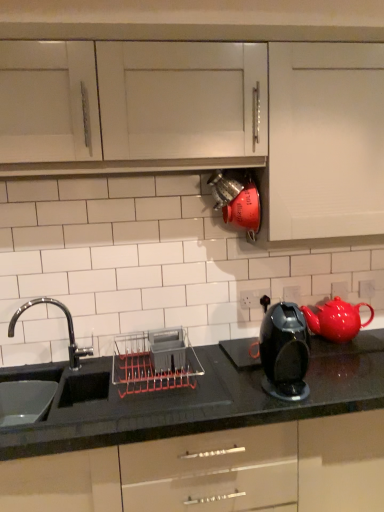
Question: Would you say red glossy teapot at right is inside or outside glossy black coffee maker at center-right?

Choices:
 (A) outside
 (B) inside

Answer: (A)

Question: Relative to glossy black coffee maker at center-right, is red glossy teapot at right in front or behind?

Choices:
 (A) behind
 (B) front

Answer: (A)

Question: Based on their relative distances, which object is nearer to the black glossy countertop at lower center?

Choices:
 (A) matte red kettle at center
 (B) glossy black coffee maker at center-right
 (C) white matte cabinet at upper right
 (D) red glossy teapot at right
 (E) gray plastic dish rack at center

Answer: (E)

Question: Which of these objects is positioned closest to the red glossy teapot at right?

Choices:
 (A) black glossy countertop at lower center
 (B) glossy black coffee maker at center-right
 (C) white matte cabinet at upper right
 (D) gray plastic dish rack at center
 (E) matte red kettle at center

Answer: (A)